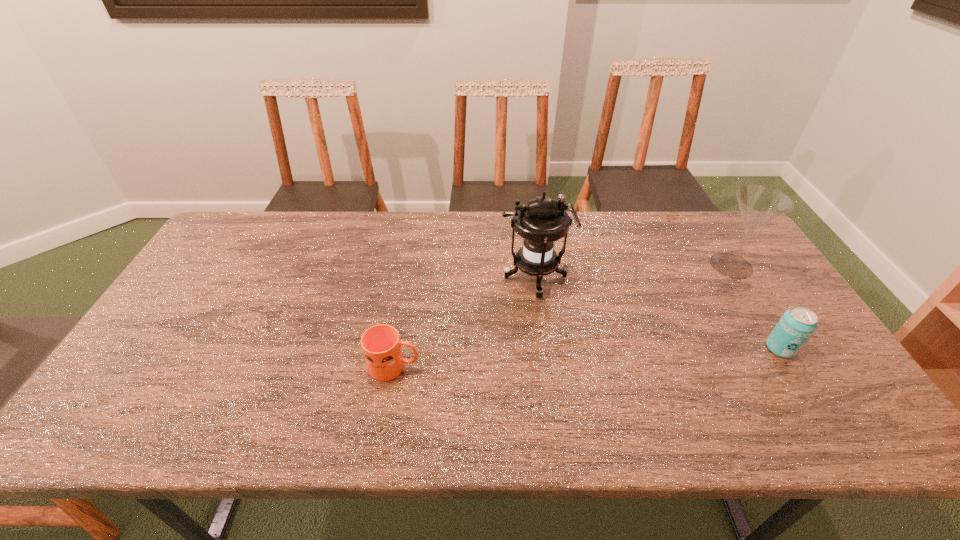
The width and height of the screenshot is (960, 540). I want to click on unoccupied area between the beer can and the mug, so click(x=588, y=357).

What are the coordinates of `free space between the lantern and the beer can` in the screenshot? It's located at (658, 313).

This screenshot has height=540, width=960. I want to click on vacant space in between the mug and the beer can, so click(x=588, y=357).

The height and width of the screenshot is (540, 960). Find the location of `unoccupied area between the leftmost object and the lantern`. unoccupied area between the leftmost object and the lantern is located at coordinates (465, 322).

Locate an element on the screen. The width and height of the screenshot is (960, 540). vacant area that lies between the mug and the third object from right to left is located at coordinates (465, 322).

The image size is (960, 540). Find the location of `unoccupied position between the leftmost object and the lantern`. unoccupied position between the leftmost object and the lantern is located at coordinates (465, 322).

Image resolution: width=960 pixels, height=540 pixels. What are the coordinates of `empty space that is in between the lantern and the beer can` in the screenshot? It's located at (658, 313).

The width and height of the screenshot is (960, 540). What are the coordinates of `free spot between the beer can and the leftmost object` in the screenshot? It's located at (588, 357).

Where is `the second closest object to the lantern`? the second closest object to the lantern is located at coordinates (759, 205).

Where is `the third closest object to the second tallest object`? The image size is (960, 540). the third closest object to the second tallest object is located at coordinates (381, 345).